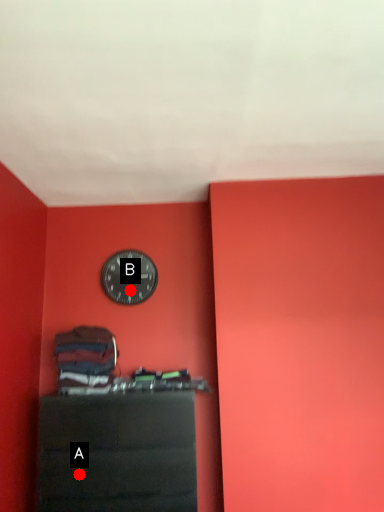
Question: Two points are circled on the image, labeled by A and B beside each circle. Which point appears closest to the camera in this image?

Choices:
 (A) A is closer
 (B) B is closer

Answer: (A)